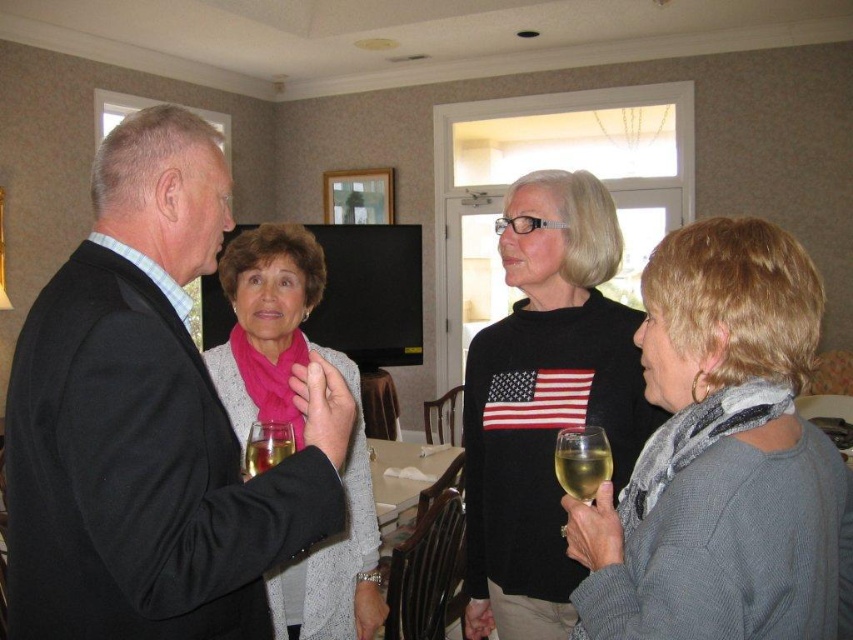
Question: Which of the following is the farthest from the observer?

Choices:
 (A) pink scarf at center
 (B) black sweater at center

Answer: (A)

Question: Which point appears farthest from the camera in this image?

Choices:
 (A) (248, 474)
 (B) (265, 520)
 (C) (595, 477)
 (D) (679, 317)

Answer: (A)

Question: Can you confirm if black suit at left is positioned below black sweater at center?

Choices:
 (A) no
 (B) yes

Answer: (A)

Question: Is gray knitted sweater at lower right positioned before translucent glass at lower center?

Choices:
 (A) yes
 (B) no

Answer: (A)

Question: Is black suit at left positioned at the back of pink scarf at center?

Choices:
 (A) yes
 (B) no

Answer: (B)

Question: Among these objects, which one is farthest from the camera?

Choices:
 (A) translucent glass at lower center
 (B) translucent glass at center
 (C) translucent glass wine glass at lower right

Answer: (A)